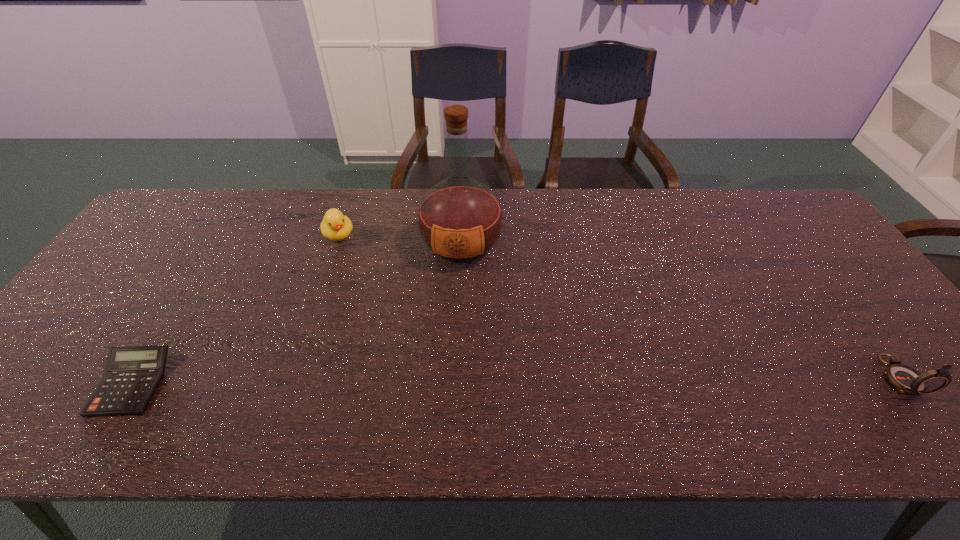
The image size is (960, 540). I want to click on free space between the rightmost object and the tallest object, so click(681, 310).

This screenshot has width=960, height=540. I want to click on free space between the second object from left to right and the liquor, so click(x=400, y=239).

Where is `free space between the liquor and the leftmost object`? Image resolution: width=960 pixels, height=540 pixels. free space between the liquor and the leftmost object is located at coordinates (297, 314).

The width and height of the screenshot is (960, 540). In order to click on empty location between the leftmost object and the third object from right to left in this screenshot , I will do `click(235, 309)`.

Identify the location of unoccupied area between the compass and the tallest object. This screenshot has height=540, width=960. (681, 310).

Point out which object is positioned as the nearest to the compass. Please provide its 2D coordinates. Your answer should be formatted as a tuple, i.e. [(x, y)], where the tuple contains the x and y coordinates of a point satisfying the conditions above.

[(460, 220)]

Where is `object that can be found as the second closest to the liquor`? The image size is (960, 540). object that can be found as the second closest to the liquor is located at coordinates (132, 375).

You are a GUI agent. You are given a task and a screenshot of the screen. Output one action in this format:
    pyautogui.click(x=<x>, y=<y>)
    Task: Click on the vacant region that satisfies the following two spatial constraints: 1. on the back side of the liquor; 2. on the right side of the leftmost object
    The width and height of the screenshot is (960, 540).
    Given the screenshot: What is the action you would take?
    point(217,245)